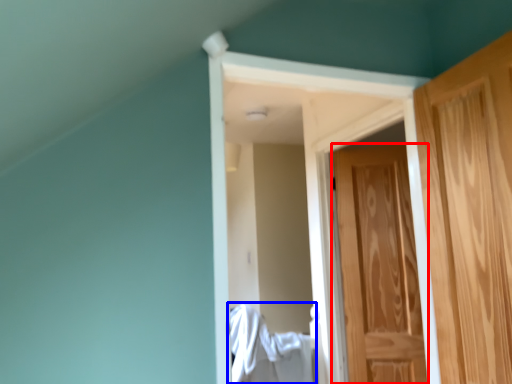
Question: Which point is closer to the camera, door (highlighted by a red box) or laundry (highlighted by a blue box)?

Choices:
 (A) door
 (B) laundry

Answer: (B)